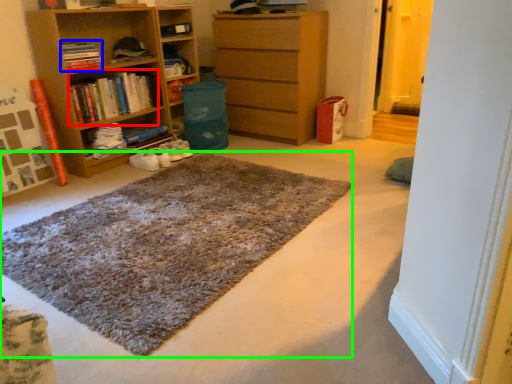
Question: Which object is positioned farthest from book (highlighted by a red box)? Select from book (highlighted by a blue box) and doormat (highlighted by a green box).

Choices:
 (A) book
 (B) doormat

Answer: (B)